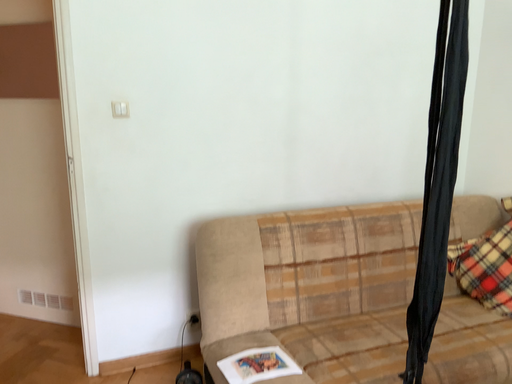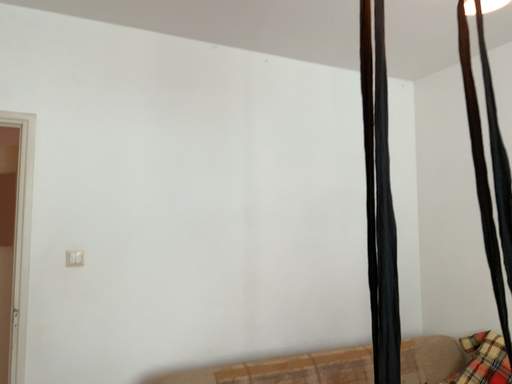
Question: Which way did the camera rotate in the video?

Choices:
 (A) rotated downward
 (B) rotated upward

Answer: (B)